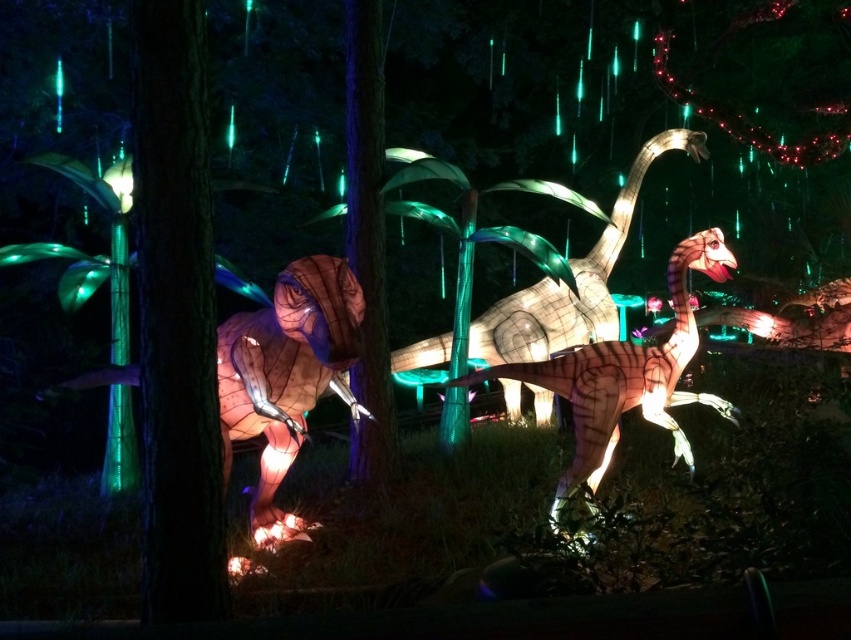
Question: Is translucent paper dinosaur at left positioned behind translucent white dinosaur at center?

Choices:
 (A) no
 (B) yes

Answer: (A)

Question: Can you confirm if translucent paper dinosaur at left is positioned below translucent white dinosaur at center?

Choices:
 (A) yes
 (B) no

Answer: (A)

Question: Which of the following is the farthest from the observer?

Choices:
 (A) (584, 461)
 (B) (478, 333)

Answer: (B)

Question: Among these points, which one is nearest to the camera?

Choices:
 (A) (654, 392)
 (B) (347, 268)
 (C) (501, 342)

Answer: (B)

Question: Which object appears farthest from the camera in this image?

Choices:
 (A) translucent paper dinosaur at left
 (B) matte brown dinosaur at center

Answer: (A)

Question: Does matte brown dinosaur at center appear on the left side of translucent white dinosaur at center?

Choices:
 (A) no
 (B) yes

Answer: (B)